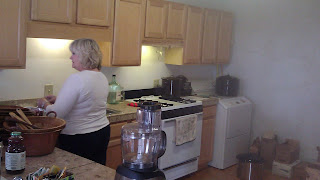
The height and width of the screenshot is (180, 320). What are the coordinates of `brown basket` in the screenshot? It's located at (49, 137).